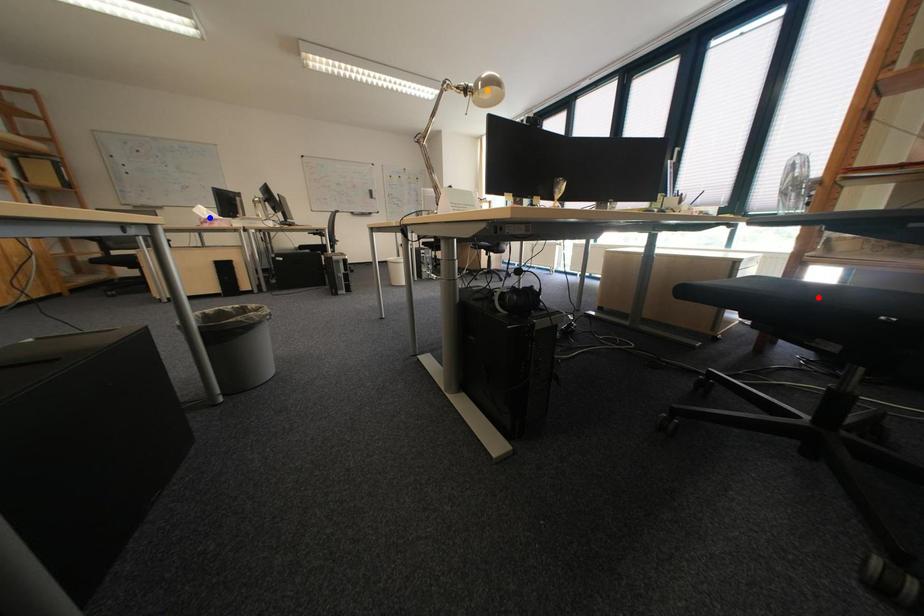
Order these from nearest to farthest:
A) blue point
B) orange point
C) red point

red point
orange point
blue point